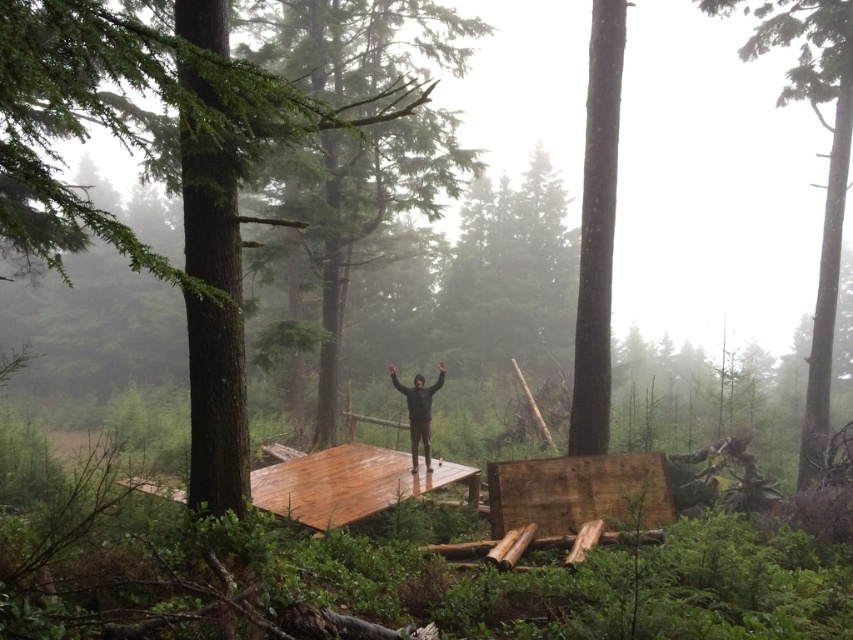
Question: Among these objects, which one is nearest to the camera?

Choices:
 (A) black matte jacket at center
 (B) smooth brown wooden platform at center

Answer: (B)

Question: Does smooth brown wooden platform at center have a lesser width compared to black matte jacket at center?

Choices:
 (A) yes
 (B) no

Answer: (B)

Question: Among these points, which one is nearest to the camera?

Choices:
 (A) (410, 467)
 (B) (194, 452)
 (C) (828, 420)
 (D) (583, 177)

Answer: (B)

Question: Which point is farther from the camera taking this photo?

Choices:
 (A) (424, 413)
 (B) (834, 196)

Answer: (B)

Question: Is smooth brown wooden platform at center further to the viewer compared to smooth bark tree at right?

Choices:
 (A) yes
 (B) no

Answer: (B)

Question: Is smooth brown wooden platform at center smaller than black matte jacket at center?

Choices:
 (A) yes
 (B) no

Answer: (B)